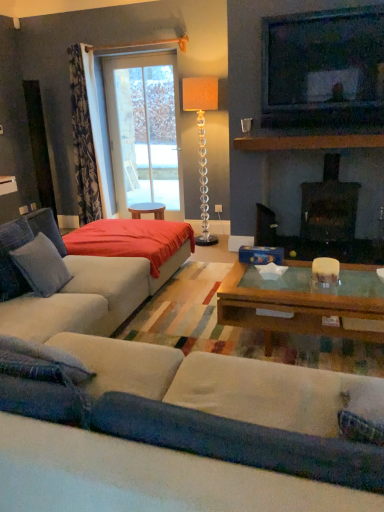
Question: Is floral fabric curtain at left looking in the opposite direction of soft gray fabric pillow at left?

Choices:
 (A) no
 (B) yes

Answer: (A)

Question: Does floral fabric curtain at left lie in front of soft gray fabric pillow at left?

Choices:
 (A) no
 (B) yes

Answer: (A)

Question: Considering the relative sizes of floral fabric curtain at left and soft gray fabric pillow at left in the image provided, is floral fabric curtain at left smaller than soft gray fabric pillow at left?

Choices:
 (A) yes
 (B) no

Answer: (B)

Question: From a real-world perspective, is floral fabric curtain at left positioned under soft gray fabric pillow at left based on gravity?

Choices:
 (A) no
 (B) yes

Answer: (A)

Question: Does floral fabric curtain at left have a larger size compared to soft gray fabric pillow at left?

Choices:
 (A) yes
 (B) no

Answer: (A)

Question: Considering the relative positions of floral fabric curtain at left and soft gray fabric pillow at left in the image provided, is floral fabric curtain at left behind soft gray fabric pillow at left?

Choices:
 (A) no
 (B) yes

Answer: (B)

Question: Can you confirm if velvet beige couch at lower center is thinner than transparent glass door at upper center?

Choices:
 (A) yes
 (B) no

Answer: (B)

Question: From a real-world perspective, is velvet beige couch at lower center positioned under transparent glass door at upper center based on gravity?

Choices:
 (A) yes
 (B) no

Answer: (A)

Question: Does velvet beige couch at lower center have a greater width compared to transparent glass door at upper center?

Choices:
 (A) yes
 (B) no

Answer: (A)

Question: Is velvet beige couch at lower center touching transparent glass door at upper center?

Choices:
 (A) no
 (B) yes

Answer: (A)

Question: Is velvet beige couch at lower center far away from transparent glass door at upper center?

Choices:
 (A) no
 (B) yes

Answer: (B)

Question: Is velvet beige couch at lower center oriented away from transparent glass door at upper center?

Choices:
 (A) no
 (B) yes

Answer: (A)

Question: Can you confirm if red fabric bed at center is wider than matte black television at upper right?

Choices:
 (A) yes
 (B) no

Answer: (A)